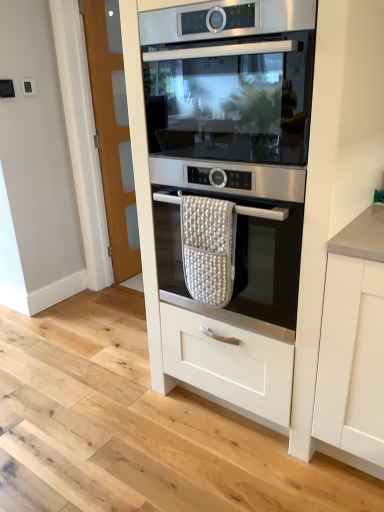
Question: Is stainless steel oven at center, which is counted as the first oven, starting from the top, shorter than white textured oven mitt at center?

Choices:
 (A) no
 (B) yes

Answer: (A)

Question: Is stainless steel oven at center, which is counted as the first oven, starting from the top, surrounding white textured oven mitt at center?

Choices:
 (A) yes
 (B) no

Answer: (A)

Question: Does stainless steel oven at center, which is counted as the first oven, starting from the top, have a greater height compared to white textured oven mitt at center?

Choices:
 (A) no
 (B) yes

Answer: (B)

Question: Is stainless steel oven at center, marked as the second oven in a bottom-to-top arrangement, positioned in front of white textured oven mitt at center?

Choices:
 (A) yes
 (B) no

Answer: (A)

Question: Is stainless steel oven at center, marked as the second oven in a bottom-to-top arrangement, positioned with its back to white textured oven mitt at center?

Choices:
 (A) no
 (B) yes

Answer: (B)

Question: Can you confirm if stainless steel oven at center, which is counted as the first oven, starting from the top, is smaller than white textured oven mitt at center?

Choices:
 (A) no
 (B) yes

Answer: (A)

Question: Is white textured oven mitt at center looking in the opposite direction of stainless steel oven at center, marked as the second oven in a bottom-to-top arrangement?

Choices:
 (A) yes
 (B) no

Answer: (A)

Question: Does white textured oven mitt at center lie behind stainless steel oven at center, which is counted as the first oven, starting from the top?

Choices:
 (A) no
 (B) yes

Answer: (B)

Question: From a real-world perspective, is white textured oven mitt at center on stainless steel oven at center, which is counted as the first oven, starting from the top?

Choices:
 (A) yes
 (B) no

Answer: (B)

Question: From a real-world perspective, is white textured oven mitt at center below stainless steel oven at center, which is counted as the first oven, starting from the top?

Choices:
 (A) no
 (B) yes

Answer: (B)

Question: Is white textured oven mitt at center bigger than stainless steel oven at center, which is counted as the first oven, starting from the top?

Choices:
 (A) yes
 (B) no

Answer: (B)

Question: Is white textured oven mitt at center smaller than stainless steel oven at center, marked as the second oven in a bottom-to-top arrangement?

Choices:
 (A) yes
 (B) no

Answer: (A)

Question: Would you say stainless steel oven at center is a long distance from satin silver oven at center, the 1th oven from the bottom?

Choices:
 (A) no
 (B) yes

Answer: (A)